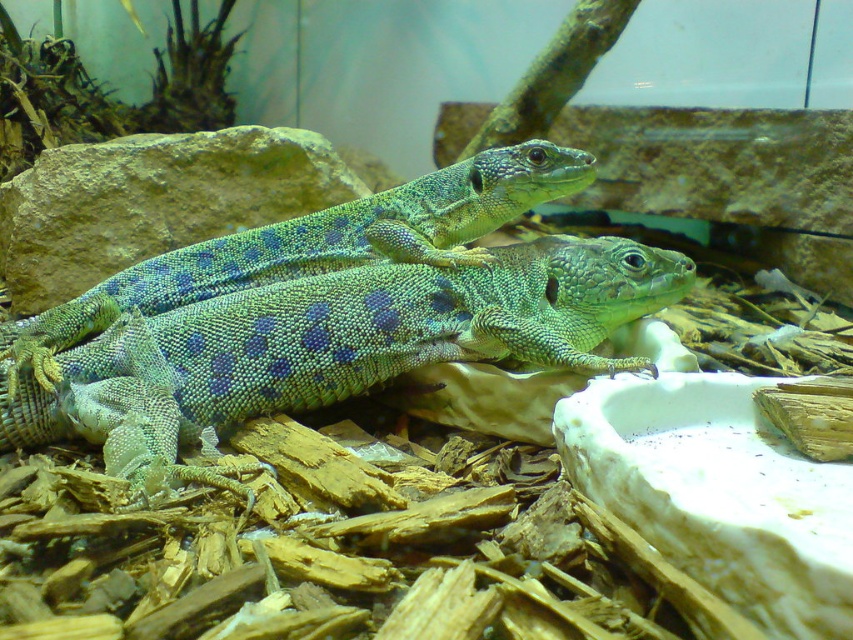
Is green textured lizard at center thinner than green scaly lizard at center?

No, green textured lizard at center is not thinner than green scaly lizard at center.

Is point (161, 483) farther from camera compared to point (380, 230)?

That is False.

Where is `green textured lizard at center`? green textured lizard at center is located at coordinates (332, 346).

The height and width of the screenshot is (640, 853). Find the location of `green textured lizard at center`. green textured lizard at center is located at coordinates (332, 346).